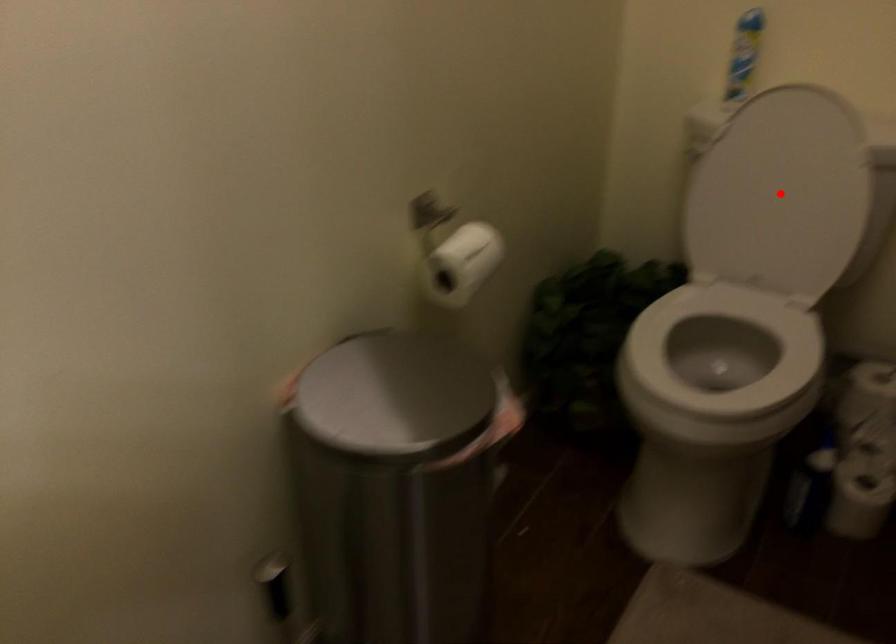
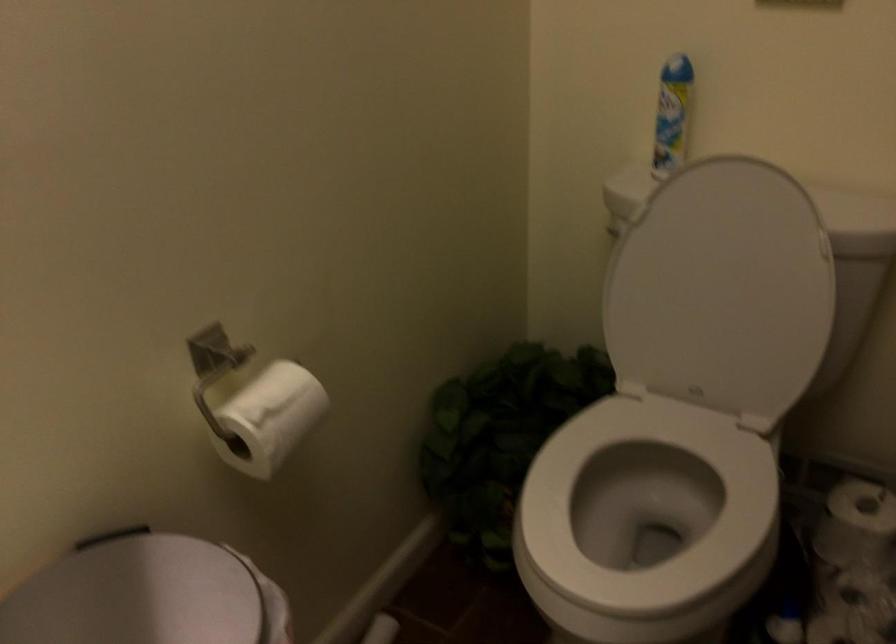
Question: A red point is marked in image1. In image2, is the corresponding 3D point closer to the camera or farther? Reply with the corresponding letter.

Choices:
 (A) The corresponding 3D point is closer.
 (B) The corresponding 3D point is farther.

Answer: (A)